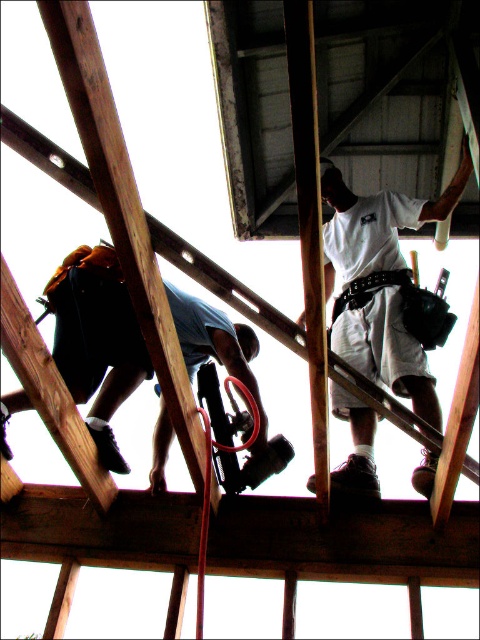
You are a safety inspector reviewing this construction site from a birdseye view. The safety regulations state that all workers must be within 1 meter of an emergency exit. The nearest emergency exit is located at point 0.5 meters from the bottom edge of the image. Can the worker wearing blue denim jeans at lower left reach the exit in time? Please explain using their coordinates.

The blue denim jeans at lower left is at point (96, 340). The nearest emergency exit is 0.5 meters from the bottom edge. Since the worker is at 0.202 on the y axis, which is above the exit position, they would need to descend 0.332 meters to reach it. This distance is within the 1 meter regulation, so yes, the worker can reach the exit in time.

Consider the image. Looking up at the construction site, you notice a worker in blue denim jeans at lower left and a white fabric construction worker at upper center. Which of these two workers is positioned to the left side of the other?

The blue denim jeans at lower left is positioned to the left of the white fabric construction worker at upper center.